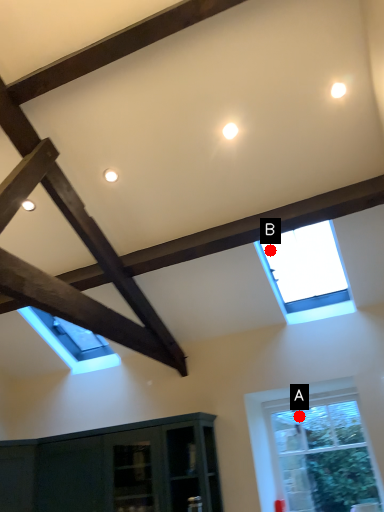
Question: Two points are circled on the image, labeled by A and B beside each circle. Among these points, which one is nearest to the camera?

Choices:
 (A) A is closer
 (B) B is closer

Answer: (B)